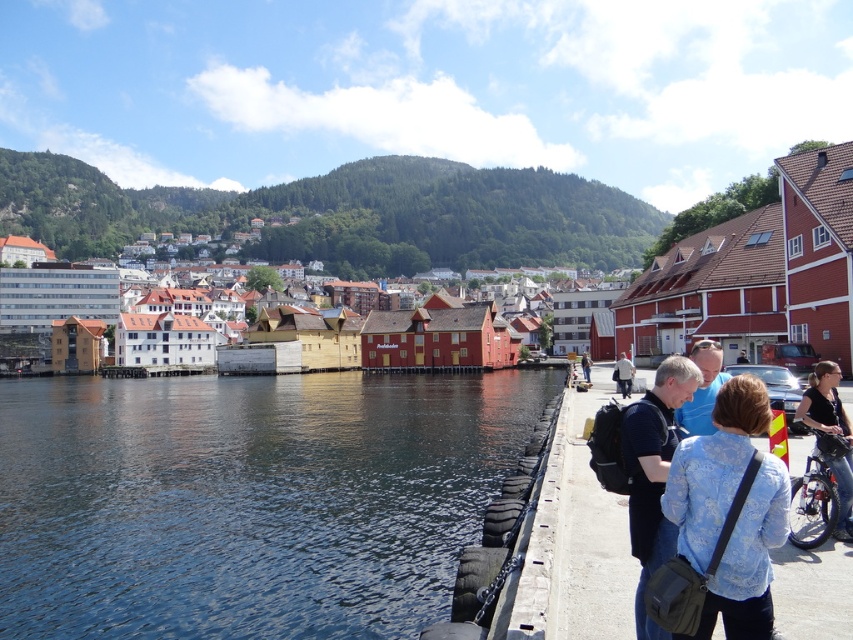
Question: Is white wooden buildings at center below light blue denim jacket at lower right?

Choices:
 (A) no
 (B) yes

Answer: (A)

Question: Which of the following is the closest to the observer?

Choices:
 (A) (695, 547)
 (B) (705, 381)
 (C) (3, 298)

Answer: (A)

Question: Which point is farther from the camera taking this photo?

Choices:
 (A) 209,406
 (B) 688,403

Answer: (A)

Question: Can you confirm if blue water at center is positioned below blue fabric shirt at center?

Choices:
 (A) no
 (B) yes

Answer: (B)

Question: Which of these objects is positioned closest to the blue fabric shirt at center?

Choices:
 (A) wooden dock at lower right
 (B) matte black backpack at lower center

Answer: (B)

Question: Can you confirm if blue water at center is positioned to the left of blue fabric shirt at center?

Choices:
 (A) no
 (B) yes

Answer: (B)